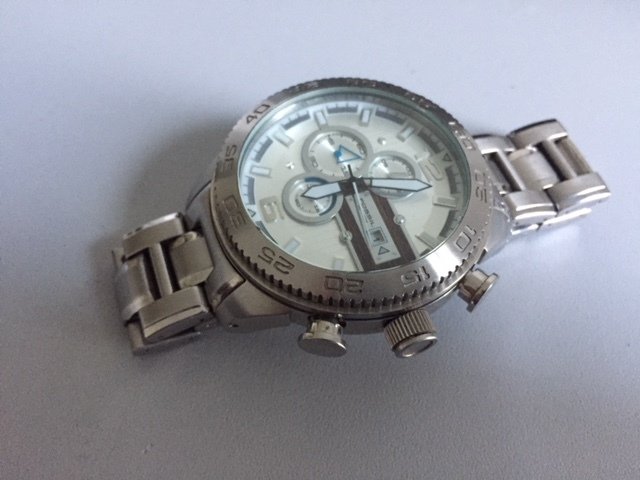
Find the location of a particular element. knob is located at coordinates (412, 342).